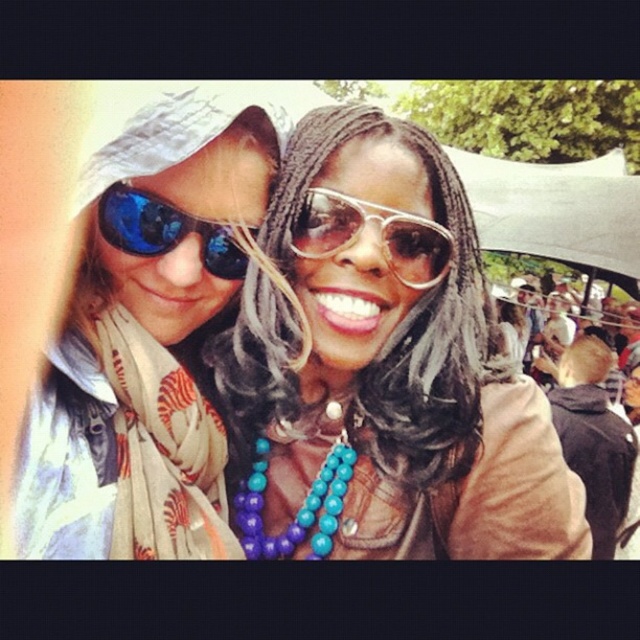
You are a photographer trying to capture a closeup shot of the matte black sunglasses at upper left and the turquoise beaded necklace at center. Which object should you focus on first if you want to ensure both are in focus without adjusting the camera settings?

The matte black sunglasses at upper left has a greater height compared to the turquoise beaded necklace at center, so focusing on the taller matte black sunglasses at upper left first would help ensure both are in focus since it is farther away and occupies more space in the frame.